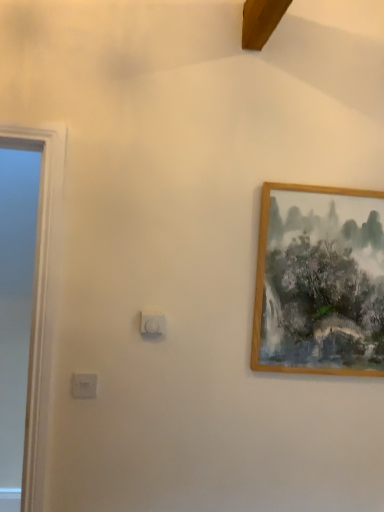
Question: Is wooden picture frame at upper right bigger or smaller than white plastic light switch at center, which is counted as the 2th light switch, starting from the left?

Choices:
 (A) big
 (B) small

Answer: (A)

Question: Is wooden picture frame at upper right spatially inside white plastic light switch at center, the 1th light switch in the top-to-bottom sequence, or outside of it?

Choices:
 (A) inside
 (B) outside

Answer: (B)

Question: Which object is the farthest from the white plastic light switch at center, the 1th light switch in the top-to-bottom sequence?

Choices:
 (A) wooden picture frame at upper right
 (B) white plastic light switch at lower left, the 2th light switch positioned from the top

Answer: (A)

Question: Which of these objects is positioned farthest from the white plastic light switch at lower left, the first light switch viewed from the left?

Choices:
 (A) wooden picture frame at upper right
 (B) white plastic light switch at center, the 1th light switch in the top-to-bottom sequence

Answer: (A)